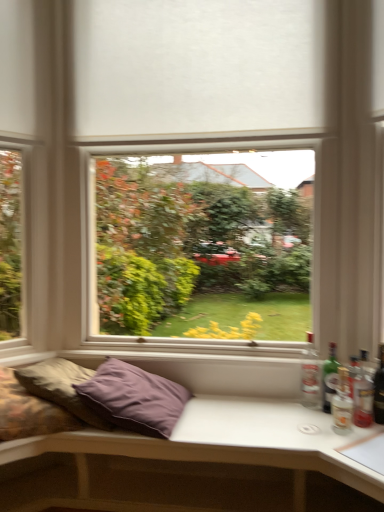
The width and height of the screenshot is (384, 512). Find the location of `free space in front of clear glass bottle at right, marked as the 1th bottle in a left-to-right arrangement`. free space in front of clear glass bottle at right, marked as the 1th bottle in a left-to-right arrangement is located at coordinates (310, 418).